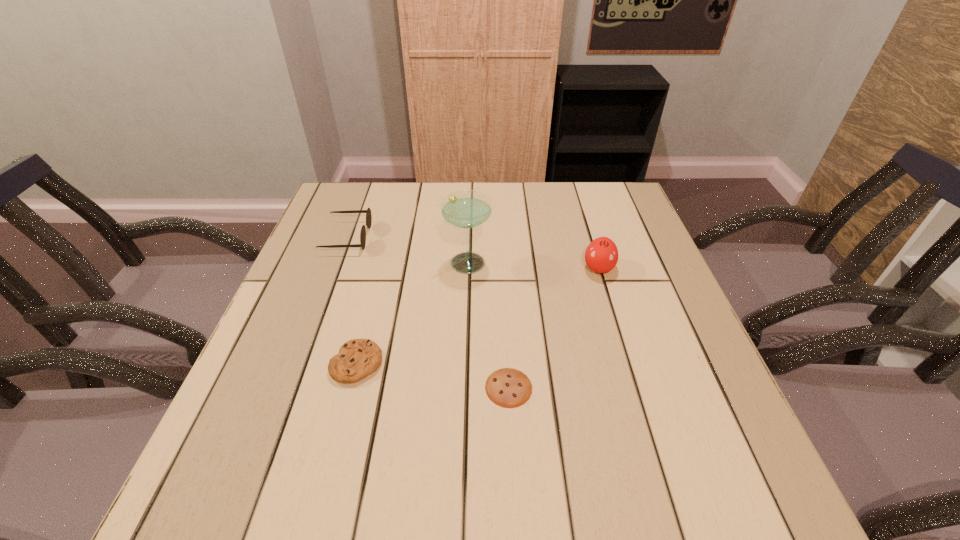
I want to click on free space that satisfies the following two spatial constraints: 1. on the front-facing side of the taller cookie; 2. on the right side of the third shortest object, so click(x=300, y=363).

Where is `vacant space that satisfies the following two spatial constraints: 1. on the front-facing side of the martini; 2. on the left side of the sunglasses`? The image size is (960, 540). vacant space that satisfies the following two spatial constraints: 1. on the front-facing side of the martini; 2. on the left side of the sunglasses is located at coordinates (338, 261).

This screenshot has width=960, height=540. I want to click on blank area in the image that satisfies the following two spatial constraints: 1. on the front-facing side of the second object from left to right; 2. on the left side of the third tallest object, so click(300, 363).

The width and height of the screenshot is (960, 540). What are the coordinates of `vacant point that satisfies the following two spatial constraints: 1. on the back side of the shorter cookie; 2. on the front-facing side of the leftmost object` in the screenshot? It's located at (500, 238).

Find the location of a particular element. This screenshot has width=960, height=540. free space that satisfies the following two spatial constraints: 1. on the front-facing side of the third shortest object; 2. on the left side of the tallest object is located at coordinates (338, 261).

This screenshot has width=960, height=540. What are the coordinates of `free space that satisfies the following two spatial constraints: 1. on the front-facing side of the sunglasses; 2. on the left side of the shorter cookie` in the screenshot? It's located at (292, 388).

Where is `free space that satisfies the following two spatial constraints: 1. on the front-facing side of the sunglasses; 2. on the left side of the left cookie`? free space that satisfies the following two spatial constraints: 1. on the front-facing side of the sunglasses; 2. on the left side of the left cookie is located at coordinates (300, 363).

Find the location of a particular element. blank space that satisfies the following two spatial constraints: 1. on the back side of the fourth tallest object; 2. on the left side of the second tallest object is located at coordinates (381, 268).